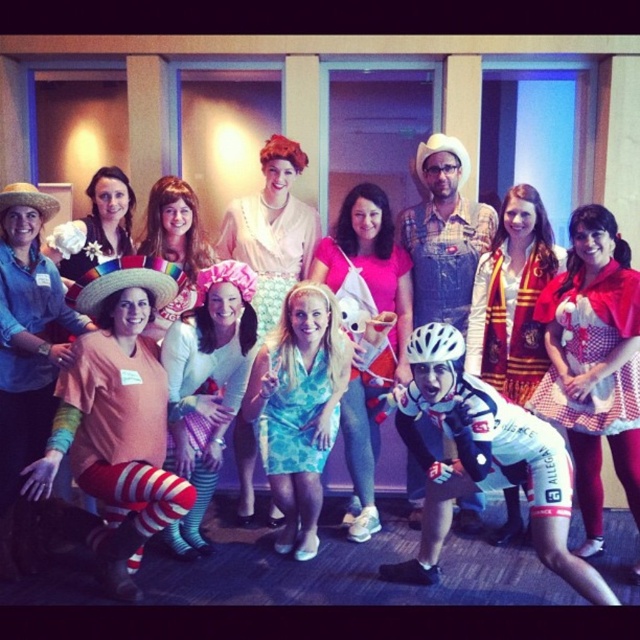
Measure the distance from rainbow striped socks at lower left to red scarf at center.

A distance of 2.42 meters exists between rainbow striped socks at lower left and red scarf at center.

Can you confirm if rainbow striped socks at lower left is wider than red scarf at center?

No.

Is point (12, 272) closer to camera compared to point (483, 340)?

Yes, it is.

Find the location of a particular element. rainbow striped socks at lower left is located at coordinates (26, 360).

In the scene shown: Is light blue fabric dress at center smaller than white matte bicycle helmet at center?

No.

Which is above, light blue fabric dress at center or white matte bicycle helmet at center?

white matte bicycle helmet at center is higher up.

Is point (364, 525) behind point (452, 352)?

Yes.

Where is `light blue fabric dress at center`? The height and width of the screenshot is (640, 640). light blue fabric dress at center is located at coordinates (371, 317).

Does rainbow striped socks at lower left lie behind light blue fabric dress at center?

That is False.

Looking at this image, can you confirm if rainbow striped socks at lower left is positioned to the left of light blue fabric dress at center?

Indeed, rainbow striped socks at lower left is positioned on the left side of light blue fabric dress at center.

Locate an element on the screen. Image resolution: width=640 pixels, height=640 pixels. rainbow striped socks at lower left is located at coordinates (26, 360).

In order to click on rainbow striped socks at lower left in this screenshot , I will do click(x=26, y=360).